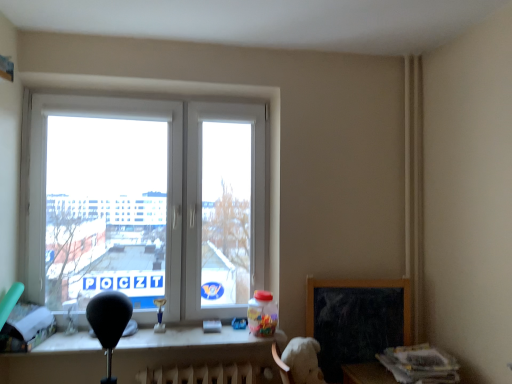
Question: Should I look upward or downward to see white plastic table at lower center?

Choices:
 (A) up
 (B) down

Answer: (B)

Question: Is black matte chalkboard at lower right positioned with its back to white plastic table at lower center?

Choices:
 (A) no
 (B) yes

Answer: (A)

Question: From the image's perspective, is black matte chalkboard at lower right located beneath white plastic table at lower center?

Choices:
 (A) yes
 (B) no

Answer: (B)

Question: Is black matte chalkboard at lower right taller than white plastic table at lower center?

Choices:
 (A) yes
 (B) no

Answer: (A)

Question: Is black matte chalkboard at lower right oriented towards white plastic table at lower center?

Choices:
 (A) yes
 (B) no

Answer: (B)

Question: Considering the relative sizes of black matte chalkboard at lower right and white plastic table at lower center in the image provided, is black matte chalkboard at lower right thinner than white plastic table at lower center?

Choices:
 (A) yes
 (B) no

Answer: (A)

Question: From a real-world perspective, is black matte chalkboard at lower right positioned over white plastic table at lower center based on gravity?

Choices:
 (A) yes
 (B) no

Answer: (A)

Question: Is white plastic window at center thinner than white plastic table at lower center?

Choices:
 (A) no
 (B) yes

Answer: (B)

Question: Is white plastic window at center placed right next to white plastic table at lower center?

Choices:
 (A) no
 (B) yes

Answer: (A)

Question: From a real-world perspective, does white plastic window at center stand above white plastic table at lower center?

Choices:
 (A) yes
 (B) no

Answer: (A)

Question: Considering the relative positions of white plastic window at center and white plastic table at lower center in the image provided, is white plastic window at center to the right of white plastic table at lower center from the viewer's perspective?

Choices:
 (A) yes
 (B) no

Answer: (B)

Question: From the image's perspective, is white plastic window at center on top of white plastic table at lower center?

Choices:
 (A) yes
 (B) no

Answer: (A)

Question: From a real-world perspective, does white plastic window at center sit lower than white plastic table at lower center?

Choices:
 (A) yes
 (B) no

Answer: (B)

Question: Is white plastic table at lower center oriented towards black matte chalkboard at lower right?

Choices:
 (A) no
 (B) yes

Answer: (A)